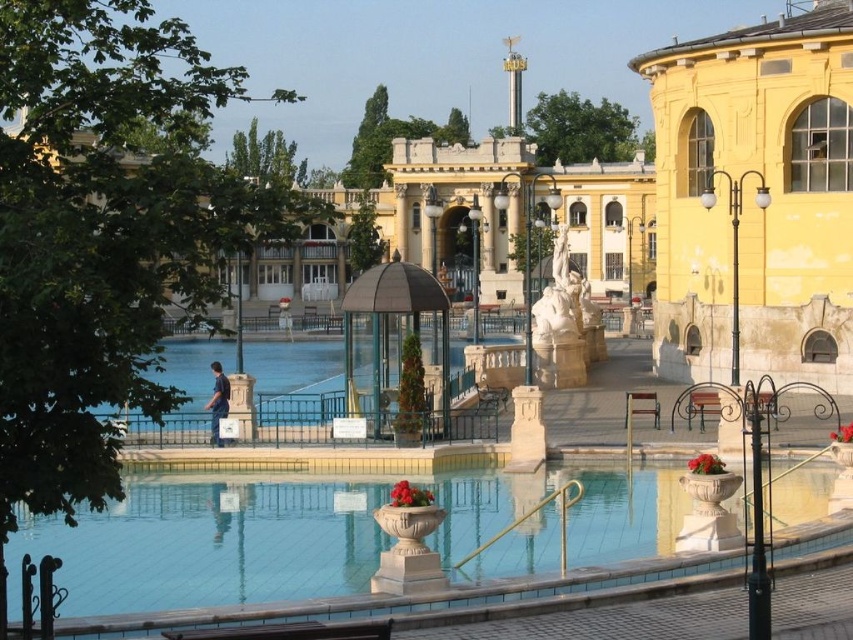
Question: Considering the real-world distances, which object is closest to the white marble statue at center?

Choices:
 (A) smooth concrete pool at center
 (B) brown wooden bench at center

Answer: (B)

Question: Is yellow painted stone building at right smaller than brown wooden bench at center?

Choices:
 (A) no
 (B) yes

Answer: (A)

Question: Which point is closer to the camera?

Choices:
 (A) (553, 337)
 (B) (653, 410)
 (C) (312, 561)
 (D) (804, 198)

Answer: (C)

Question: Can you confirm if clear glass water at center is smaller than white marble statue at center?

Choices:
 (A) yes
 (B) no

Answer: (A)

Question: Is white marble statue at center below brown wooden bench at center?

Choices:
 (A) yes
 (B) no

Answer: (B)

Question: Which point appears farthest from the camera in this image?

Choices:
 (A) (752, 211)
 (B) (210, 355)
 (C) (628, 394)
 (D) (555, 262)

Answer: (B)